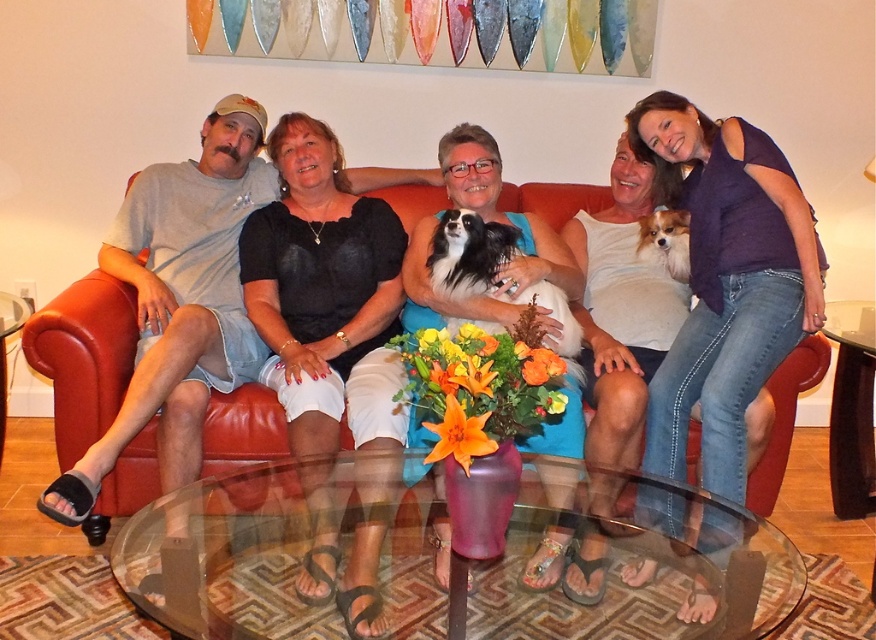
Does blue denim jeans at right have a smaller size compared to black silky dog at center?

Incorrect, blue denim jeans at right is not smaller in size than black silky dog at center.

Which is more to the left, blue denim jeans at right or black silky dog at center?

black silky dog at center

Measure the distance between point (712, 122) and camera.

Point (712, 122) and camera are 2.41 meters apart from each other.

Locate an element on the screen. blue denim jeans at right is located at coordinates (726, 282).

Is black velvet blouse at center further to camera compared to black silky dog at center?

No, it is in front of black silky dog at center.

Who is more forward, (341, 285) or (450, 230)?

Positioned in front is point (450, 230).

Is point (373, 304) farther from viewer compared to point (451, 289)?

Yes, point (373, 304) is behind point (451, 289).

Where is `black velvet blouse at center`? black velvet blouse at center is located at coordinates (325, 294).

Which is behind, point (435, 280) or point (673, 248)?

The point (673, 248) is more distant.

Does point (451, 234) come closer to viewer compared to point (638, 224)?

That is True.

Measure the distance between black silky dog at center and camera.

The distance of black silky dog at center from camera is 2.25 meters.

The height and width of the screenshot is (640, 876). I want to click on black silky dog at center, so click(x=470, y=252).